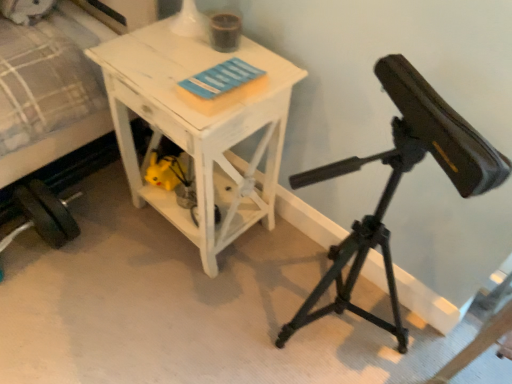
Find the location of a particular element. Image resolution: width=512 pixels, height=384 pixels. vacant space to the left of white distressed wood table at center is located at coordinates (104, 230).